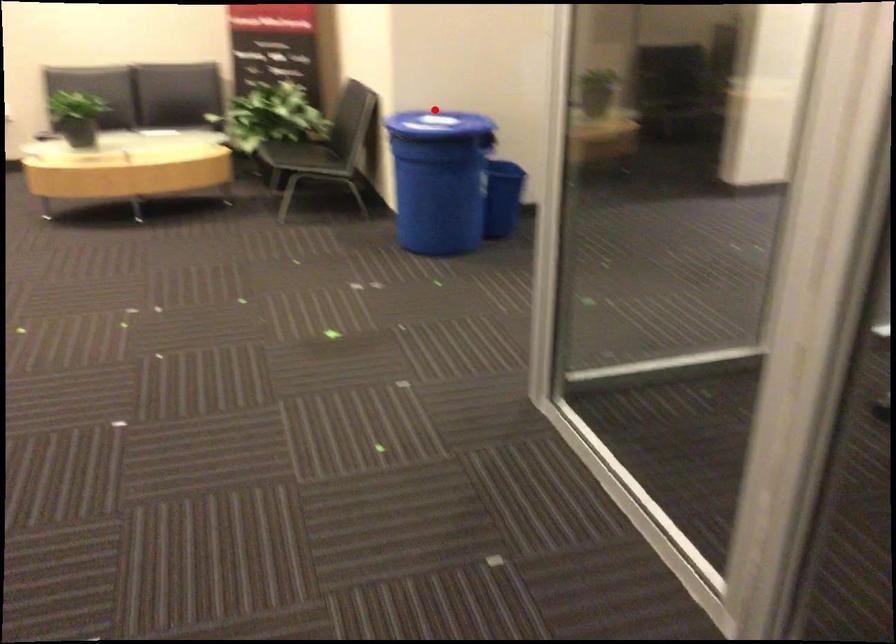
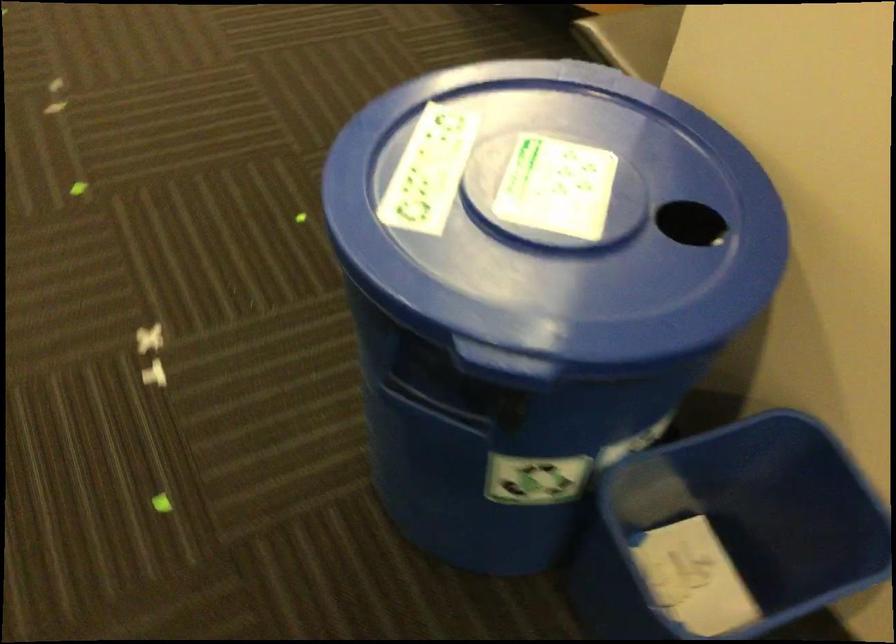
Question: I am providing you with two images of the same scene from different viewpoints. A red point is shown in image1. For the corresponding object point in image2, is it positioned nearer or farther from the camera?

Choices:
 (A) Nearer
 (B) Farther

Answer: (A)